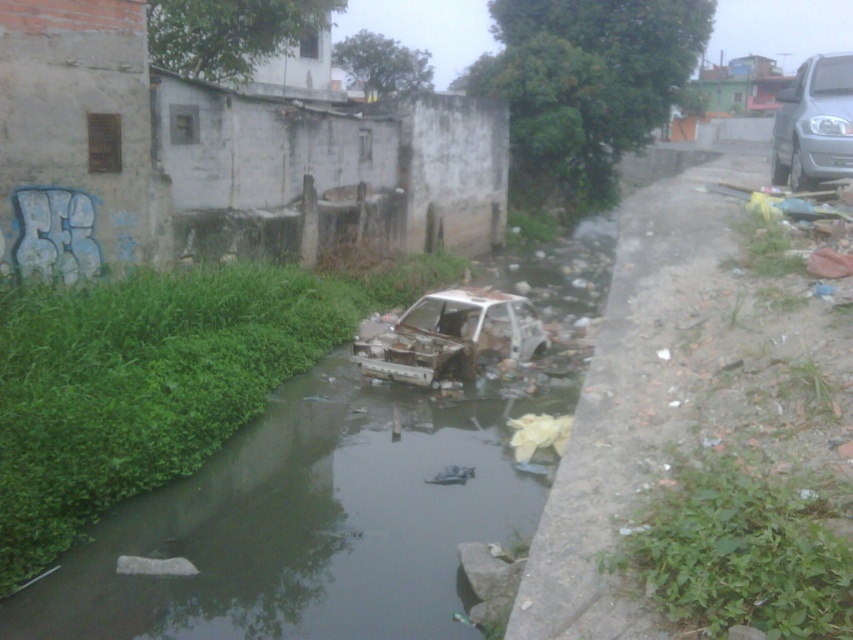
Between rusty metal car at center and silver metallic van at right, which one appears on the left side from the viewer's perspective?

From the viewer's perspective, rusty metal car at center appears more on the left side.

Does rusty metal car at center appear on the right side of silver metallic van at right?

No, rusty metal car at center is not to the right of silver metallic van at right.

You are a GUI agent. You are given a task and a screenshot of the screen. Output one action in this format:
    pyautogui.click(x=<x>, y=<y>)
    Task: Click on the rusty metal car at center
    The width and height of the screenshot is (853, 640).
    Given the screenshot: What is the action you would take?
    pyautogui.click(x=450, y=337)